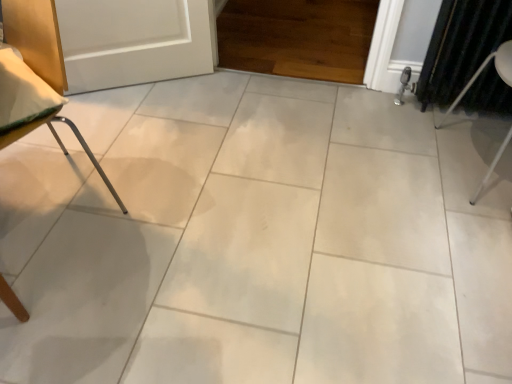
The width and height of the screenshot is (512, 384). What are the coordinates of `vacant area that is in front of dark green fabric curtain at right` in the screenshot? It's located at (443, 135).